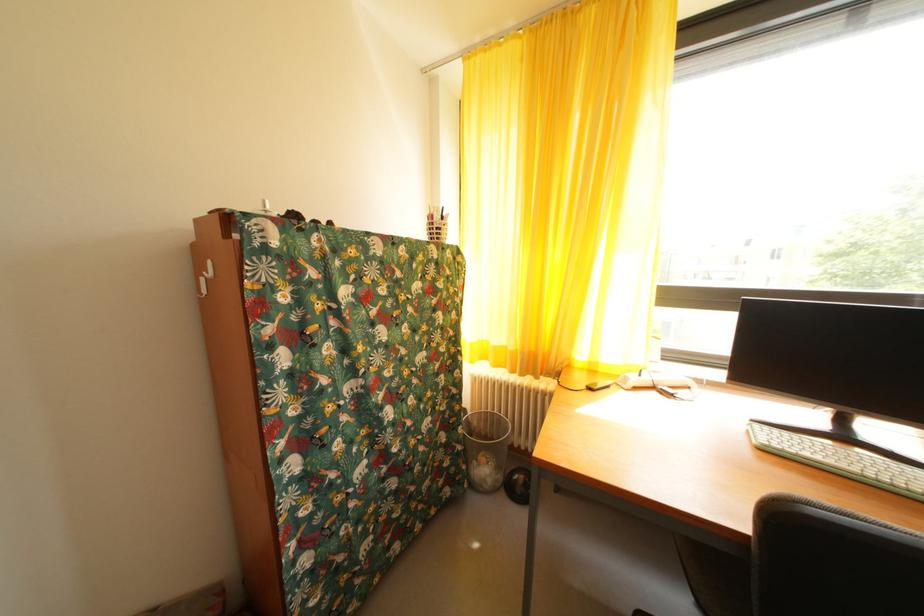
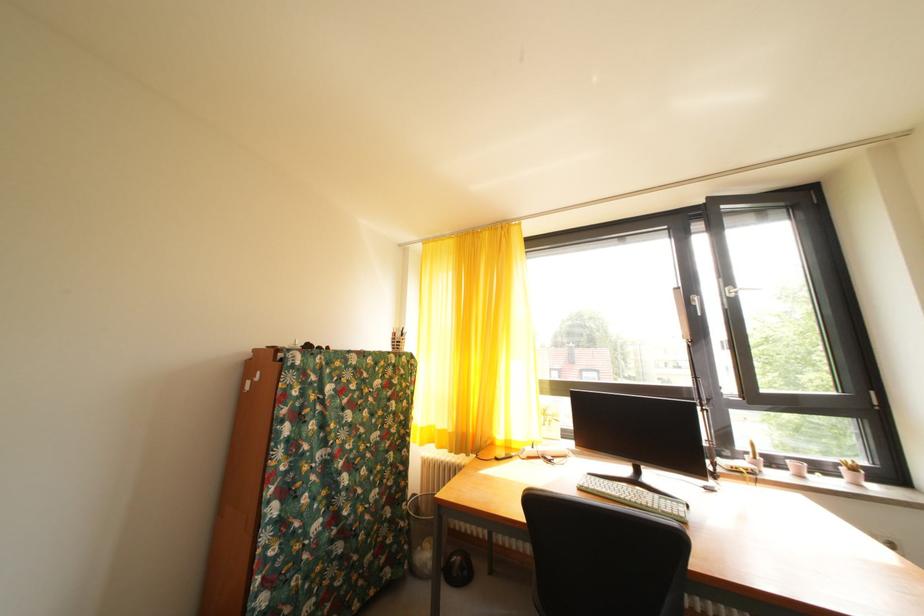
Looking at this image, which direction would the cameraman need to move to produce the second image?

The movement direction of the cameraman is right, backward.